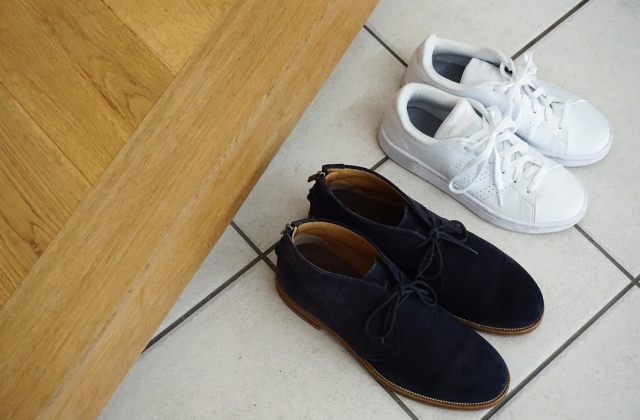
Identify the location of wooden planks. (12, 214), (81, 118), (172, 34), (171, 181).